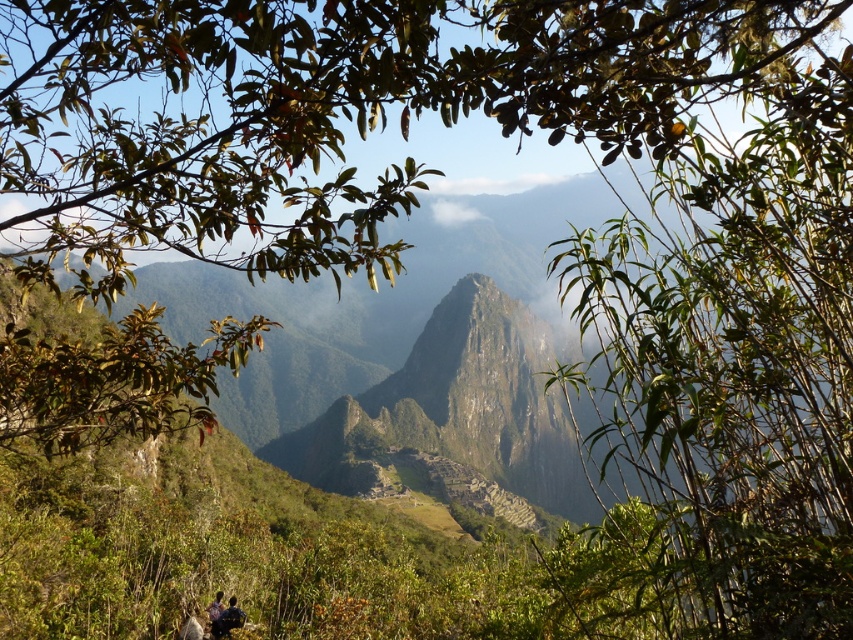
You are a photographer planning to capture a wide shot of Machu Picchu. You notice a person wearing a dark blue shirt at lower left in the scene. To avoid including this person in your photo, should you adjust your camera to the left or right?

The dark blue shirt at lower left is located at point 0.969 on the x axis and 0.267 on the y axis. To avoid including this person in your photo, you should adjust your camera to the right.

You are a hiker standing at point (198, 632) and want to reach point (244, 618). Is the destination visible from your current position?

Point (244, 618) is behind point (198, 632), so the destination is not visible from your current position.